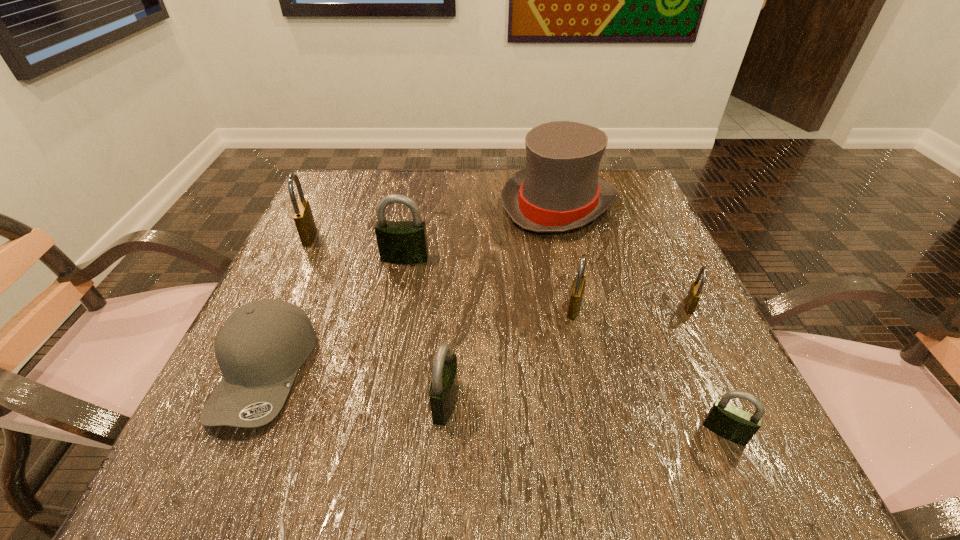
The image size is (960, 540). Find the location of `free space that is in between the fourth padlock from left to right and the gray dress hat`. free space that is in between the fourth padlock from left to right and the gray dress hat is located at coordinates (566, 256).

Locate an element on the screen. Image resolution: width=960 pixels, height=540 pixels. empty space between the rightmost black padlock and the fourth padlock from left to right is located at coordinates (649, 370).

In order to click on free space between the dress hat and the smallest black padlock in this screenshot , I will do `click(641, 318)`.

Where is `vacant area that lies between the second brass padlock from left to right and the second farthest padlock`? vacant area that lies between the second brass padlock from left to right and the second farthest padlock is located at coordinates (490, 284).

Find the location of `object that ranks as the third closest to the fifth object from right to left`. object that ranks as the third closest to the fifth object from right to left is located at coordinates (399, 242).

You are a GUI agent. You are given a task and a screenshot of the screen. Output one action in this format:
    pyautogui.click(x=<x>, y=<y>)
    Task: Click on the object identified as the closest to the dress hat
    The width and height of the screenshot is (960, 540).
    Given the screenshot: What is the action you would take?
    pyautogui.click(x=399, y=242)

This screenshot has width=960, height=540. What are the coordinates of `the third closest padlock relative to the fifth nearest padlock` in the screenshot? It's located at (443, 392).

At what (x,y) coordinates should I click in order to perform the action: click on padlock identified as the third closest to the second smallest brass padlock. Please return your answer as a coordinate pair (x, y). This screenshot has height=540, width=960. Looking at the image, I should click on (732, 423).

Find the location of a particular element. This screenshot has width=960, height=540. brass padlock identified as the closest to the biggest black padlock is located at coordinates (303, 217).

Select which brass padlock appears as the second closest to the farthest brass padlock. Please provide its 2D coordinates. Your answer should be formatted as a tuple, i.e. [(x, y)], where the tuple contains the x and y coordinates of a point satisfying the conditions above.

[(695, 291)]